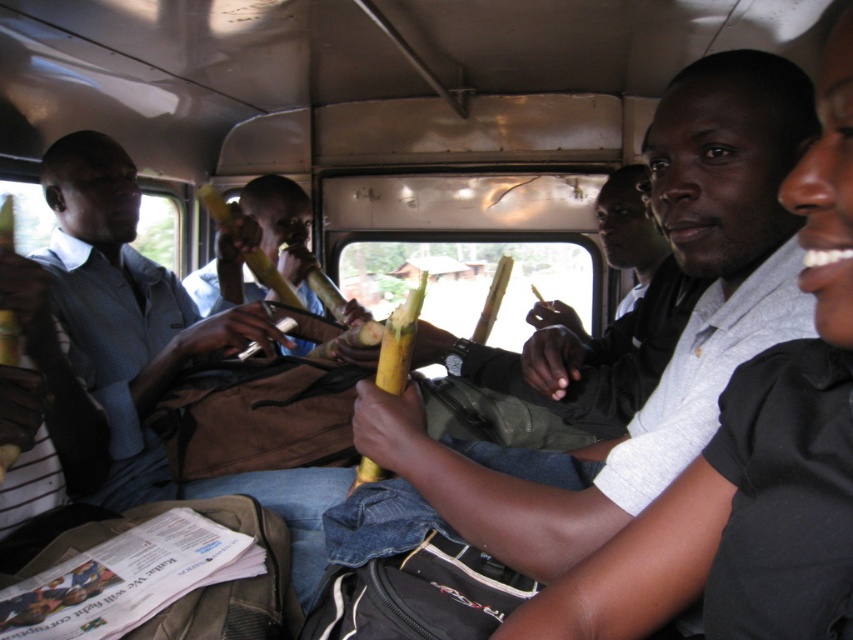
Question: Is smooth yellow banana at center closer to camera compared to matte blue shirt at center?

Choices:
 (A) no
 (B) yes

Answer: (B)

Question: Observing the image, what is the correct spatial positioning of matte blue shirt at center in reference to smooth brown banana at center?

Choices:
 (A) right
 (B) left

Answer: (A)

Question: Which point is farther to the camera?

Choices:
 (A) (148, 310)
 (B) (316, 310)

Answer: (B)

Question: Among these objects, which one is nearest to the camera?

Choices:
 (A) smooth yellow banana at center
 (B) smooth brown banana at center
 (C) matte blue shirt at center

Answer: (A)

Question: Is smooth yellow banana at center to the left of smooth brown banana at center from the viewer's perspective?

Choices:
 (A) yes
 (B) no

Answer: (B)

Question: Which object appears farthest from the camera in this image?

Choices:
 (A) matte blue shirt at center
 (B) smooth brown banana at center
 (C) smooth yellow banana at center

Answer: (B)